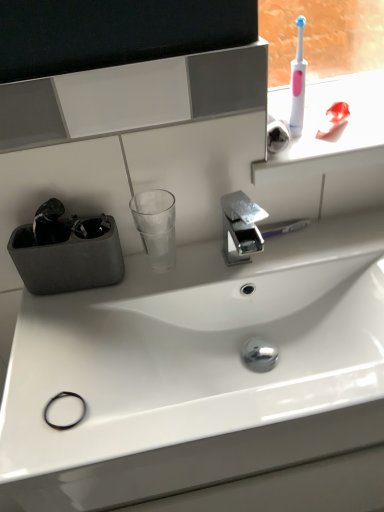
In order to click on free location to the left of transparent glass at center in this screenshot , I will do `click(85, 302)`.